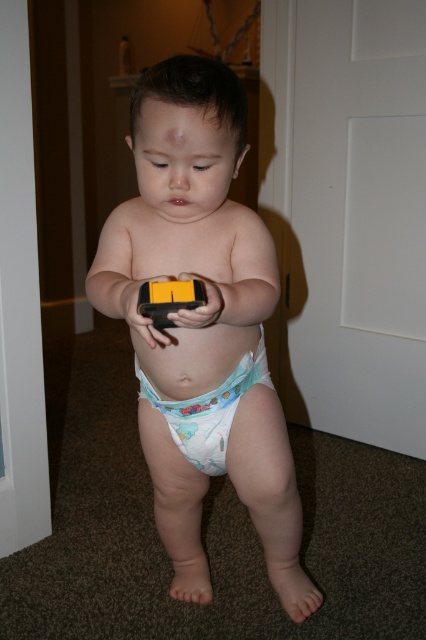
Can you confirm if white fabric diaper at center is positioned above yellow plastic remote at center?

Incorrect, white fabric diaper at center is not positioned above yellow plastic remote at center.

Identify the location of white fabric diaper at center. Image resolution: width=426 pixels, height=640 pixels. (209, 412).

Which is in front, point (256, 360) or point (167, 292)?

Point (167, 292) is in front.

The image size is (426, 640). In order to click on white fabric diaper at center in this screenshot , I will do `click(209, 412)`.

In the scene shown: Can you confirm if white cloth diaper at center is positioned below white fabric diaper at center?

Correct, white cloth diaper at center is located below white fabric diaper at center.

Who is shorter, white cloth diaper at center or white fabric diaper at center?

white fabric diaper at center is shorter.

Who is more forward, (x=169, y=269) or (x=221, y=397)?

Positioned in front is point (x=169, y=269).

Locate an element on the screen. white cloth diaper at center is located at coordinates (201, 324).

Can you confirm if white cloth diaper at center is positioned to the right of yellow plastic remote at center?

Incorrect, white cloth diaper at center is not on the right side of yellow plastic remote at center.

Locate an element on the screen. The image size is (426, 640). white cloth diaper at center is located at coordinates (201, 324).